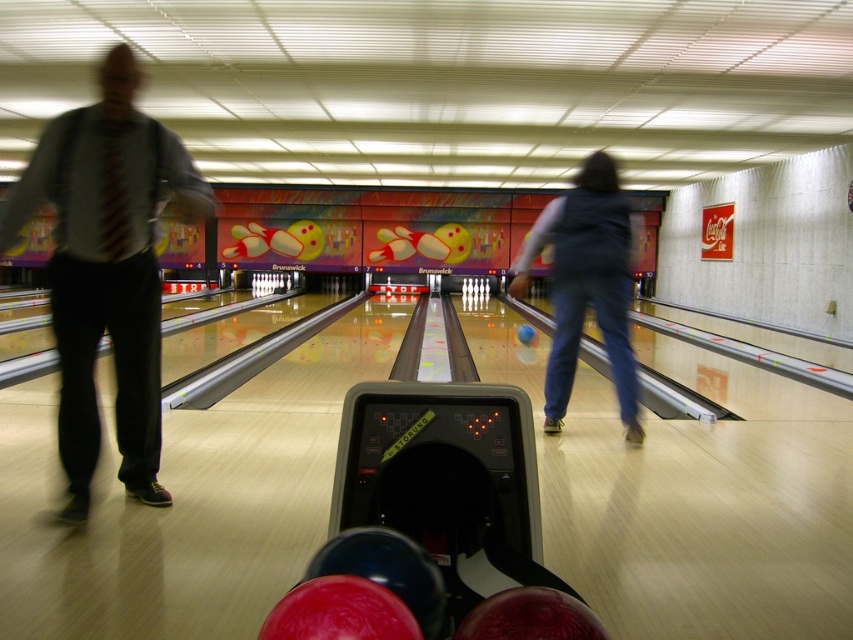
Looking at this image, can you confirm if matte gray shirt at left is shorter than blue denim jeans at center?

No, matte gray shirt at left is not shorter than blue denim jeans at center.

Does matte gray shirt at left have a lesser width compared to blue denim jeans at center?

In fact, matte gray shirt at left might be wider than blue denim jeans at center.

At what (x,y) coordinates should I click in order to perform the action: click on matte gray shirt at left. Please return your answer as a coordinate pair (x, y). Looking at the image, I should click on (107, 269).